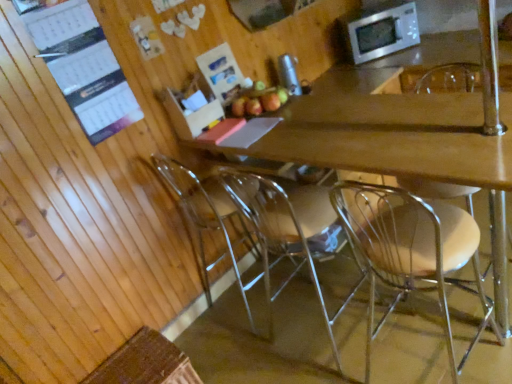
Question: From a real-world perspective, is clear plastic chair at lower center, the 4th chair when ordered from right to left, beneath wooden desk at center?

Choices:
 (A) yes
 (B) no

Answer: (B)

Question: Are clear plastic chair at lower center, the 4th chair when ordered from right to left, and wooden desk at center far apart?

Choices:
 (A) yes
 (B) no

Answer: (B)

Question: Can you confirm if clear plastic chair at lower center, which appears as the first chair when viewed from the left, is shorter than wooden desk at center?

Choices:
 (A) yes
 (B) no

Answer: (B)

Question: Is clear plastic chair at lower center, the 4th chair when ordered from right to left, surrounding wooden desk at center?

Choices:
 (A) no
 (B) yes

Answer: (A)

Question: Is clear plastic chair at lower center, which appears as the first chair when viewed from the left, wider than wooden desk at center?

Choices:
 (A) yes
 (B) no

Answer: (B)

Question: Considering the positions of point (384, 241) and point (509, 243), is point (384, 241) closer or farther from the camera than point (509, 243)?

Choices:
 (A) farther
 (B) closer

Answer: (B)

Question: From a real-world perspective, relative to clear plastic chair at center, which is the 4th chair from left to right, is clear plastic chair at center, arranged as the 3th chair when viewed from the left, vertically above or below?

Choices:
 (A) below
 (B) above

Answer: (A)

Question: Is clear plastic chair at center, arranged as the 3th chair when viewed from the left, inside the boundaries of clear plastic chair at center, which is the 4th chair from left to right, or outside?

Choices:
 (A) inside
 (B) outside

Answer: (B)

Question: From the image's perspective, is clear plastic chair at center, arranged as the 3th chair when viewed from the left, above or below clear plastic chair at center, which is the 4th chair from left to right?

Choices:
 (A) below
 (B) above

Answer: (A)

Question: Would you say clear plastic chair at lower center, which appears as the first chair when viewed from the left, is to the left or to the right of white paper calendar at upper left in the picture?

Choices:
 (A) left
 (B) right

Answer: (B)

Question: Considering their positions, is clear plastic chair at lower center, the 4th chair when ordered from right to left, located in front of or behind white paper calendar at upper left?

Choices:
 (A) behind
 (B) front

Answer: (A)

Question: Considering the positions of point (193, 210) and point (65, 23), is point (193, 210) closer or farther from the camera than point (65, 23)?

Choices:
 (A) farther
 (B) closer

Answer: (A)

Question: In terms of height, does clear plastic chair at lower center, which appears as the first chair when viewed from the left, look taller or shorter compared to white paper calendar at upper left?

Choices:
 (A) tall
 (B) short

Answer: (A)

Question: Considering the positions of clear plastic chair at center, the 1th chair from the right, and wooden desk at center in the image, is clear plastic chair at center, the 1th chair from the right, taller or shorter than wooden desk at center?

Choices:
 (A) tall
 (B) short

Answer: (A)

Question: From a real-world perspective, relative to wooden desk at center, is clear plastic chair at center, the 1th chair from the right, vertically above or below?

Choices:
 (A) above
 (B) below

Answer: (A)